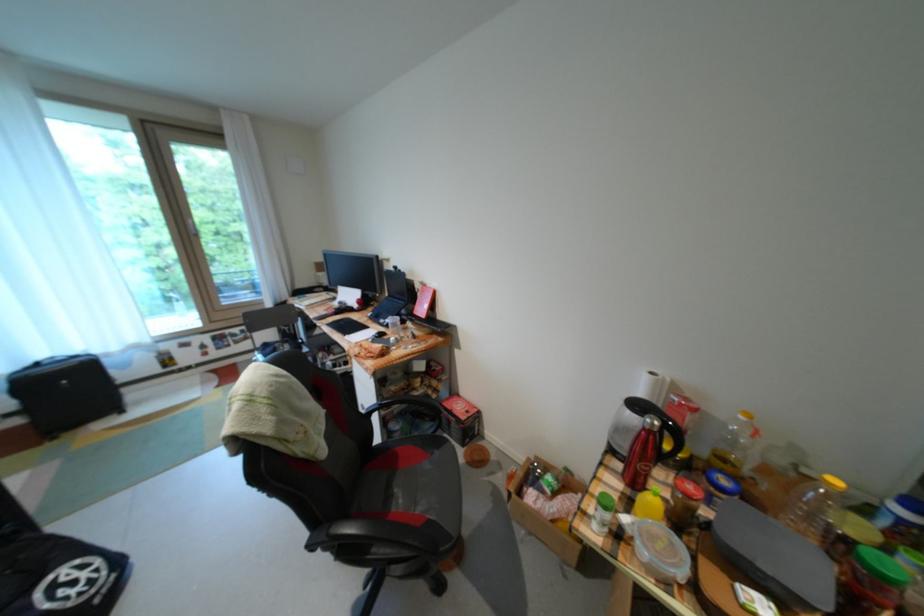
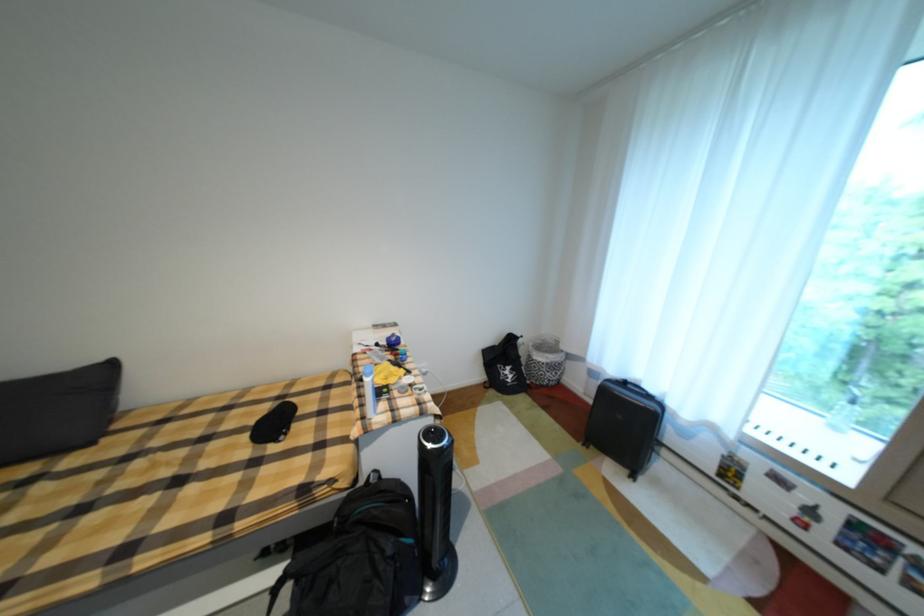
Where in the second image is the point corresponding to point 47,366 from the first image?

(635, 384)